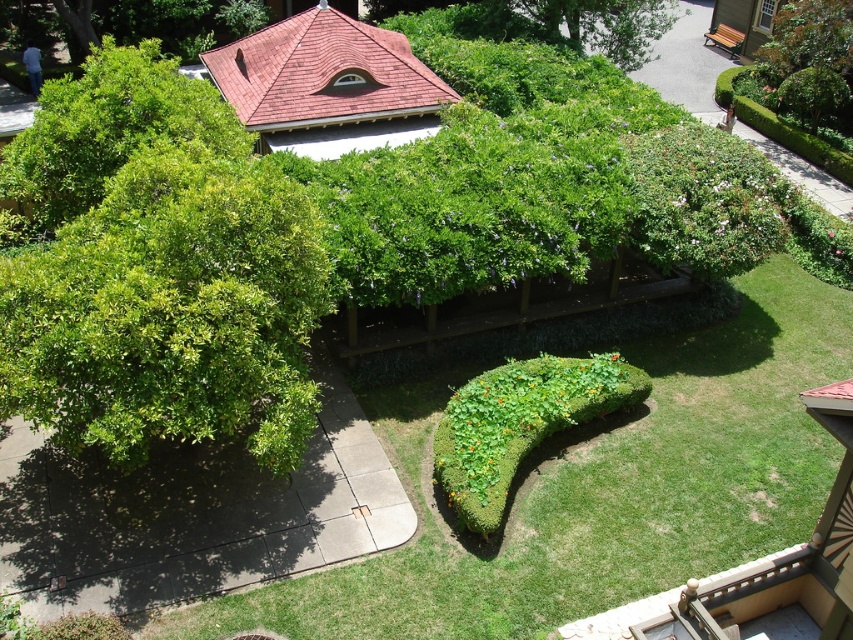
Question: Observing the image, what is the correct spatial positioning of green leafy grass at center in reference to green leafy bush at upper center?

Choices:
 (A) above
 (B) below

Answer: (B)

Question: Which of these objects is positioned closest to the green leafy bush at upper left?

Choices:
 (A) green leafy bush at upper center
 (B) green leafy bush at center

Answer: (B)

Question: Among these points, which one is farthest from the camera?

Choices:
 (A) (587, 385)
 (B) (782, 106)
 (C) (625, 512)
 (D) (178, 204)

Answer: (B)

Question: Which point appears closest to the camera in this image?

Choices:
 (A) (107, 291)
 (B) (648, 10)

Answer: (A)

Question: Considering the relative positions of green leafy bush at left and green leafy bush at upper left in the image provided, where is green leafy bush at left located with respect to green leafy bush at upper left?

Choices:
 (A) left
 (B) right

Answer: (B)

Question: Is green leafy bush at left to the right of green leafy bush at upper center from the viewer's perspective?

Choices:
 (A) no
 (B) yes

Answer: (A)